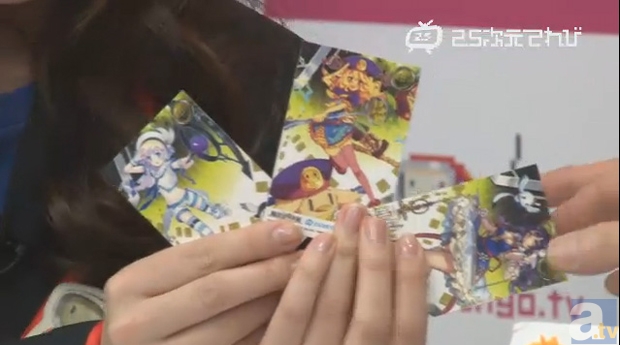
I want to click on white wall, so click(490, 94).